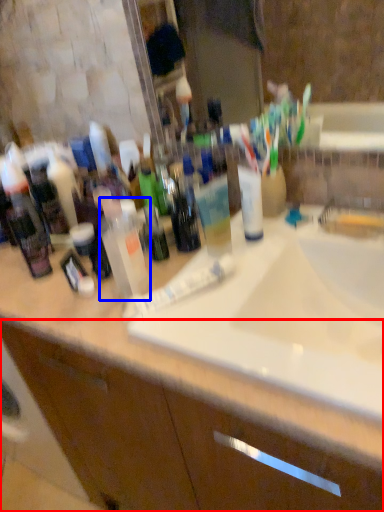
Question: Which of the following is the closest to the observer, bathroom cabinet (highlighted by a red box) or cleaning product (highlighted by a blue box)?

Choices:
 (A) bathroom cabinet
 (B) cleaning product

Answer: (A)